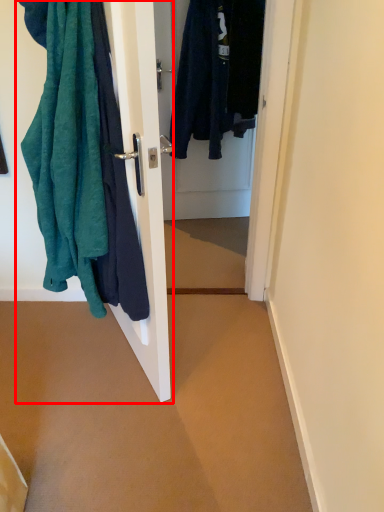
Question: In this image, where is closet (annotated by the red box) located relative to door?

Choices:
 (A) left
 (B) right

Answer: (A)